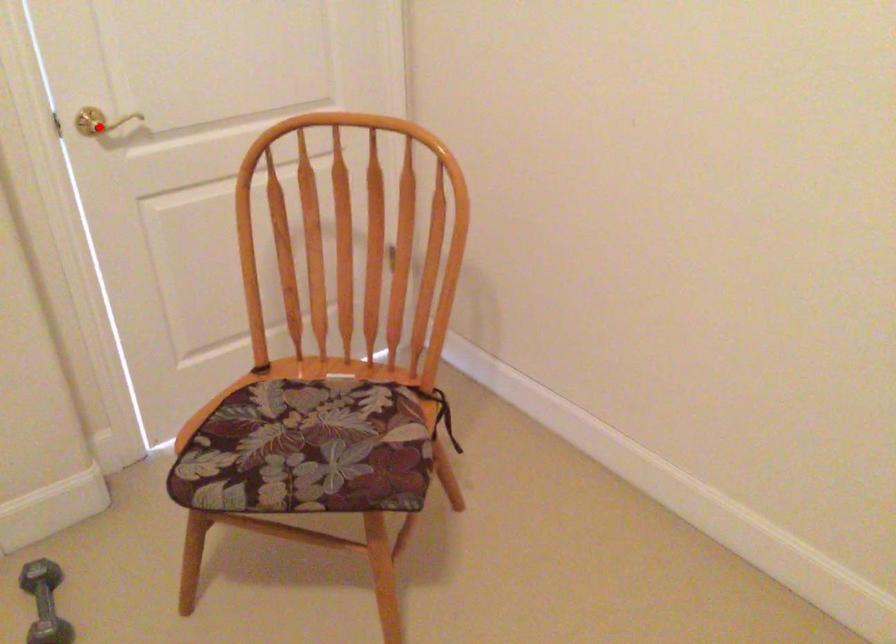
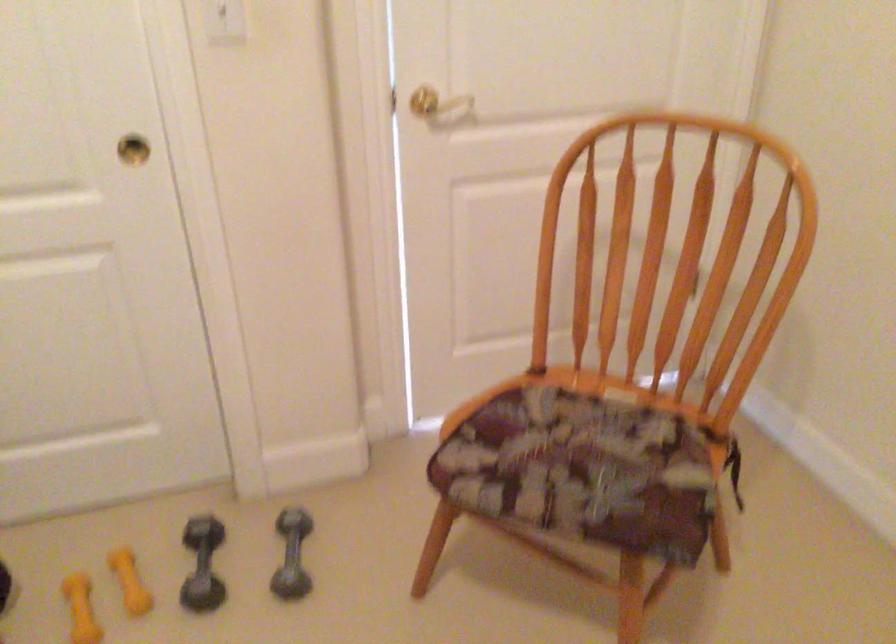
Question: I am providing you with two images of the same scene from different viewpoints. A red point is marked on the first image. Is the red point's position out of view in image 2?

Choices:
 (A) Yes
 (B) No

Answer: (B)